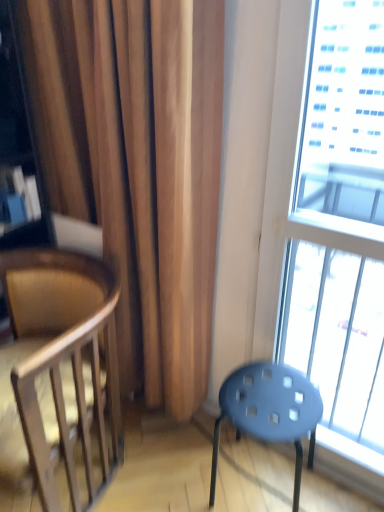
Question: From the image's perspective, is transparent glass window at right located above wooden chair at left?

Choices:
 (A) no
 (B) yes

Answer: (B)

Question: Is transparent glass window at right facing away from wooden chair at left?

Choices:
 (A) no
 (B) yes

Answer: (A)

Question: Can you confirm if transparent glass window at right is positioned to the right of wooden chair at left?

Choices:
 (A) no
 (B) yes

Answer: (B)

Question: Considering the relative sizes of transparent glass window at right and wooden chair at left in the image provided, is transparent glass window at right wider than wooden chair at left?

Choices:
 (A) no
 (B) yes

Answer: (A)

Question: Considering the relative sizes of transparent glass window at right and wooden chair at left in the image provided, is transparent glass window at right smaller than wooden chair at left?

Choices:
 (A) no
 (B) yes

Answer: (B)

Question: Is the depth of transparent glass window at right less than that of wooden chair at left?

Choices:
 (A) yes
 (B) no

Answer: (A)

Question: Is wooden chair at left at the right side of matte blue stool at lower right?

Choices:
 (A) no
 (B) yes

Answer: (A)

Question: From the image's perspective, would you say wooden chair at left is positioned over matte blue stool at lower right?

Choices:
 (A) no
 (B) yes

Answer: (B)

Question: Can you confirm if wooden chair at left is shorter than matte blue stool at lower right?

Choices:
 (A) no
 (B) yes

Answer: (A)

Question: Is wooden chair at left aimed at matte blue stool at lower right?

Choices:
 (A) no
 (B) yes

Answer: (A)

Question: From the image's perspective, is wooden chair at left below matte blue stool at lower right?

Choices:
 (A) yes
 (B) no

Answer: (B)

Question: Can you confirm if wooden chair at left is taller than matte blue stool at lower right?

Choices:
 (A) no
 (B) yes

Answer: (B)

Question: Can you confirm if matte blue stool at lower right is wider than wooden chair at left?

Choices:
 (A) yes
 (B) no

Answer: (B)